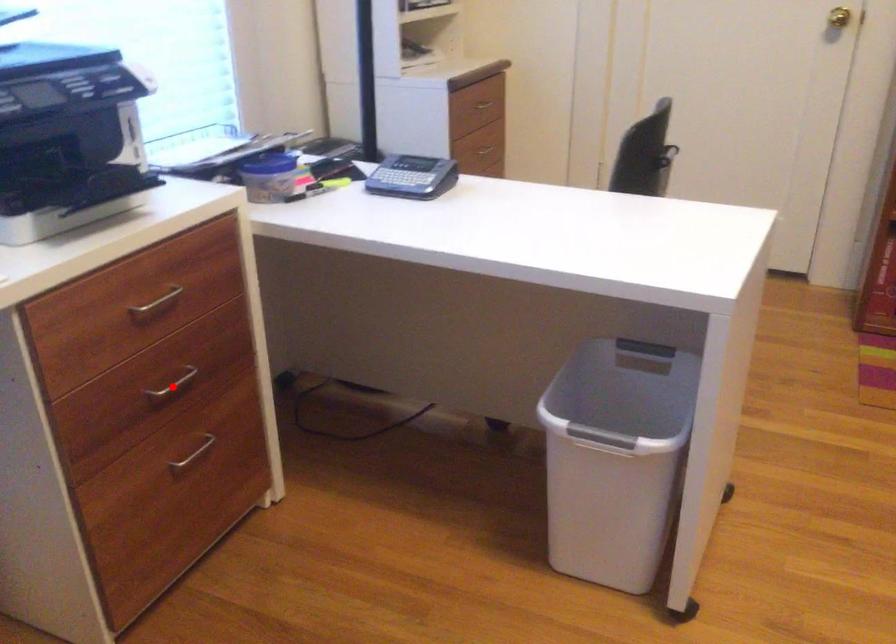
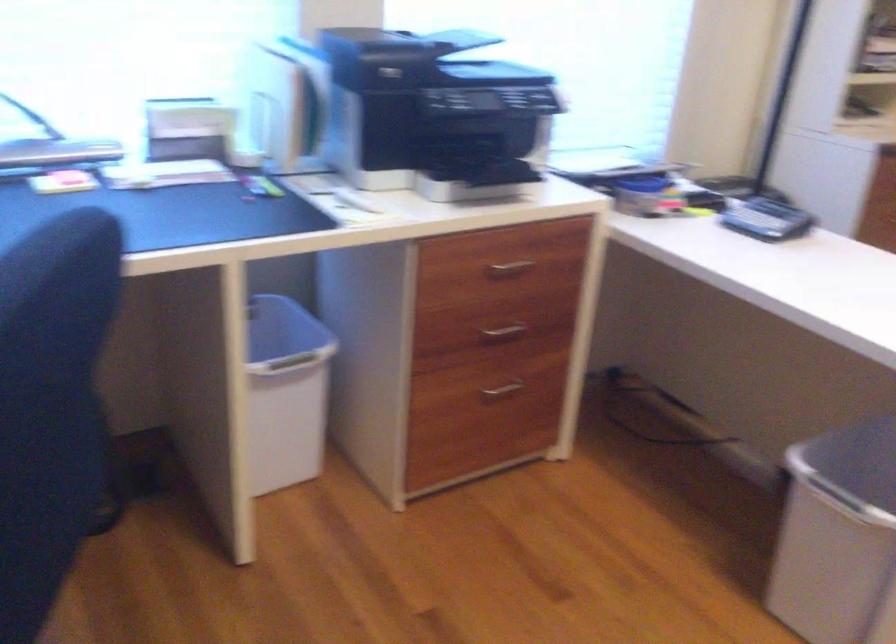
Where in the second image is the point corresponding to the highlighted location from the first image?

(503, 330)